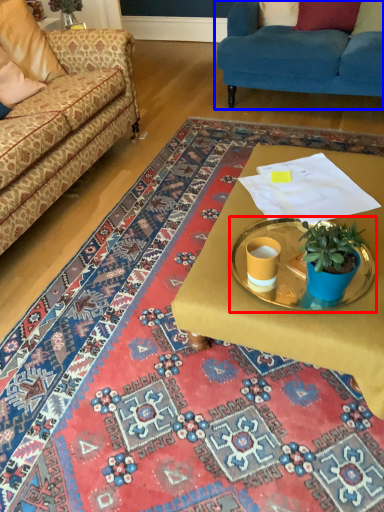
Question: Which object appears closest to the camera in this image, round table (highlighted by a red box) or studio couch (highlighted by a blue box)?

Choices:
 (A) round table
 (B) studio couch

Answer: (A)